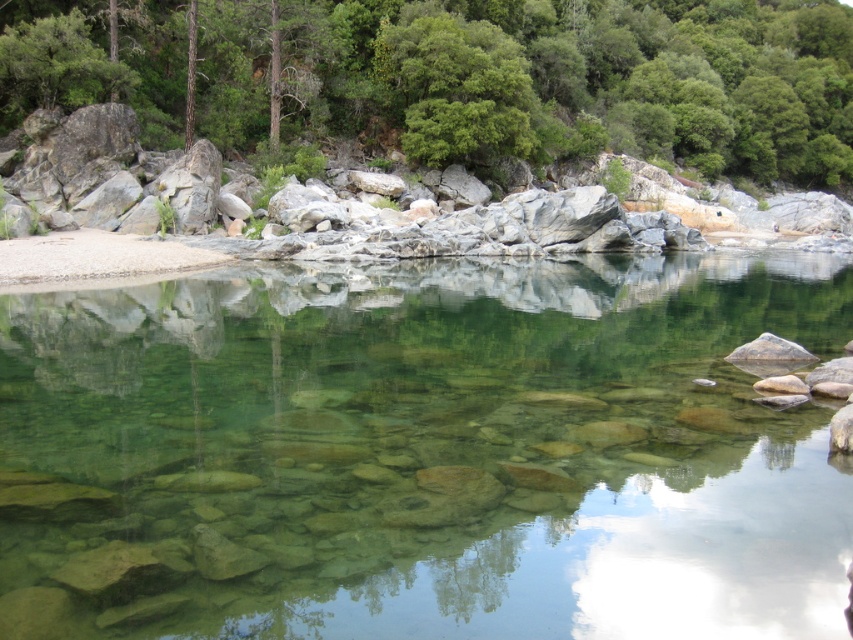
You are standing at the edge of the clear glassy water at center and want to look up at the green leafy tree at upper center. Since you are 1.7 meters tall, can you see the top of the tree without bending down or moving your head?

The clear glassy water at center has a lesser height compared to the green leafy tree at upper center, so the tree is taller than the water surface. Since you are 1.7 meters tall, you can see the top of the green leafy tree at upper center without needing to adjust your position.

You are standing at the edge of the serene natural landscape and want to cross to the other side. The clear glassy water at center is your path. Can you safely walk across it?

The clear glassy water at center is located at point (x=422, y=452), which might indicate its depth or position, but without specific depth information, it is unsafe to assume the water is shallow enough to walk across. Proceed with caution or find another route.

You are an environmental scientist assessing the water quality of the clear glassy water at center and the green leafy tree at upper center. Which object has a smaller width in the image?

The clear glassy water at center is thinner than the green leafy tree at upper center, so the clear glassy water at center has a smaller width.